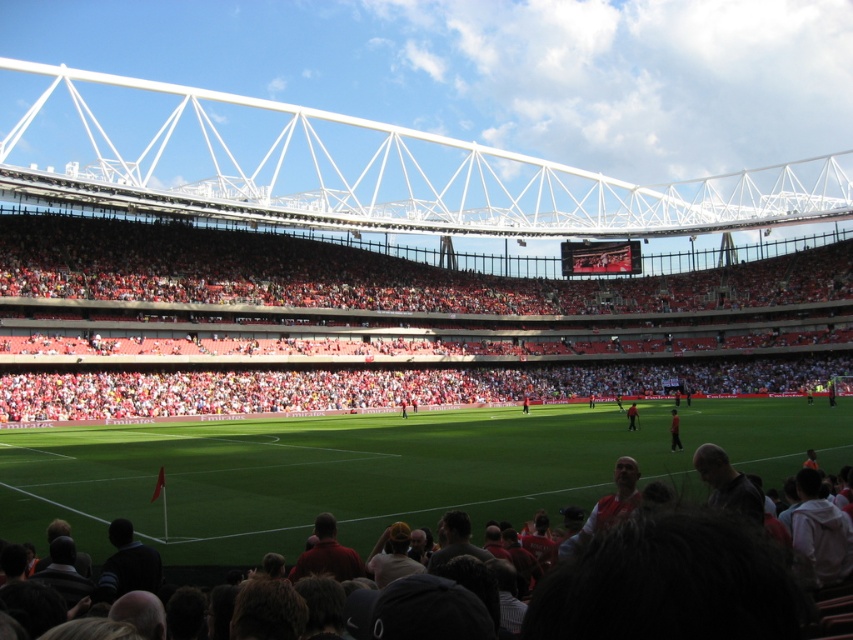
Does dark gray clothing at lower center have a greater width compared to red plastic seats at center?

Incorrect, dark gray clothing at lower center's width does not surpass red plastic seats at center's.

Does point (131, 433) lie in front of point (71, 285)?

Yes, point (131, 433) is closer to viewer.

Who is more forward, (321, 506) or (738, 272)?

Point (321, 506) is more forward.

What are the coordinates of `dark gray clothing at lower center` in the screenshot? It's located at (300, 483).

Find the location of a particular element. green grass football field at center is located at coordinates (378, 470).

Is green grass football field at center to the right of red plastic seats at center from the viewer's perspective?

Yes, green grass football field at center is to the right of red plastic seats at center.

The height and width of the screenshot is (640, 853). I want to click on green grass football field at center, so click(378, 470).

At what (x,y) coordinates should I click in order to perform the action: click on green grass football field at center. Please return your answer as a coordinate pair (x, y). The image size is (853, 640). Looking at the image, I should click on (378, 470).

Which is in front, point (338, 432) or point (675, 444)?

Point (675, 444)

Find the location of `green grass football field at center`. green grass football field at center is located at coordinates (378, 470).